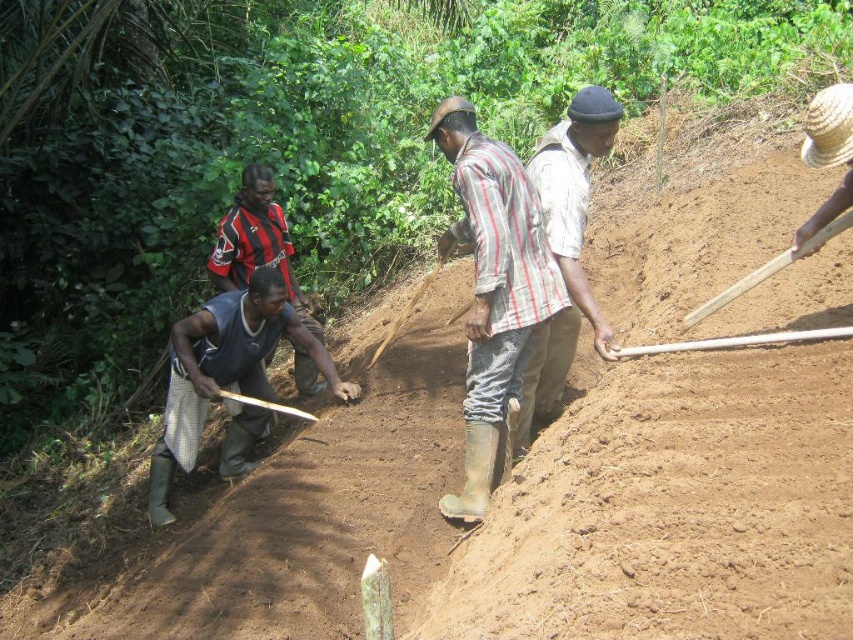
You are standing at the origin point of the coordinate system in the image. Which direction should you move to reach the light brown fabric shirt at center?

The light brown fabric shirt at center is located at point (566,246), so you should move northeast to reach it.

You are an observer standing at the edge of the field looking towards the group. Which object, the gray fabric shirt at center or the wooden shovel at center, is positioned to the right side?

The wooden shovel at center is positioned to the right side of the gray fabric shirt at center.

You are standing in the middle of the agricultural field and want to reach both the point at coordinates point (555, 209) and point (410, 296). Which point will you reach first?

You will reach point (555, 209) first because it is closer to the camera than point (410, 296).